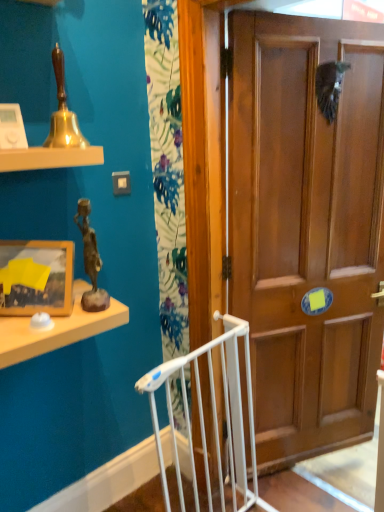
Identify the location of free space above wooden door at center (from a real-world perspective). This screenshot has height=512, width=384. (302, 14).